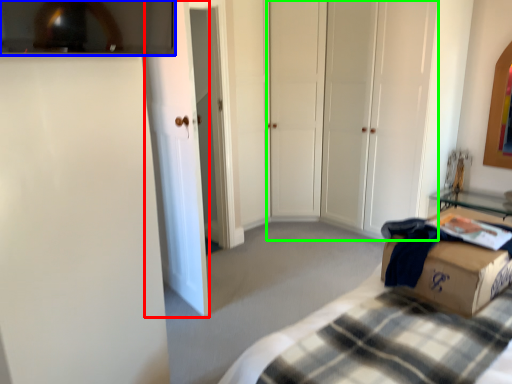
Question: Based on their relative distances, which object is farther from glass door (highlighted by a red box)? Choose from glass window (highlighted by a blue box) and glass door (highlighted by a green box).

Choices:
 (A) glass window
 (B) glass door

Answer: (B)